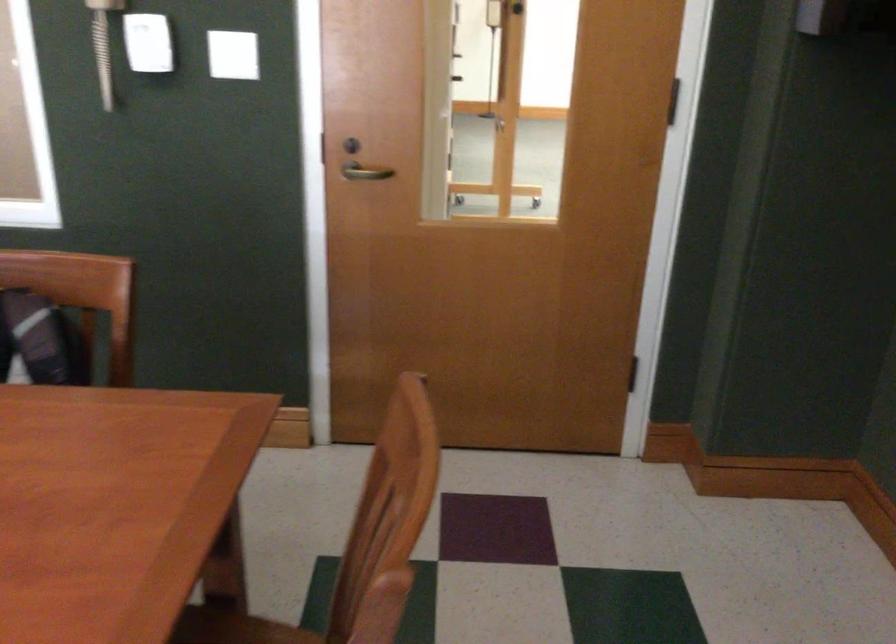
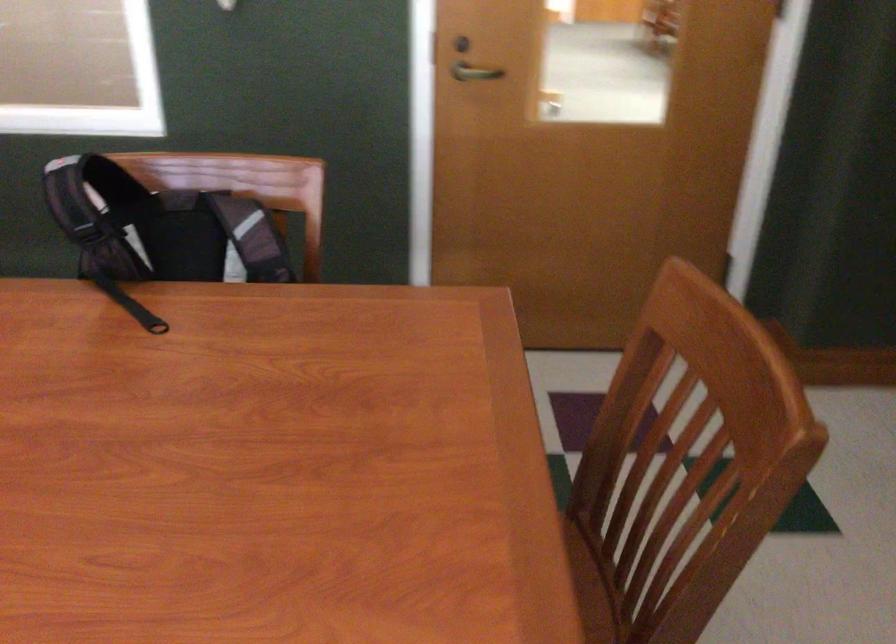
Question: The images are taken continuously from a first-person perspective. In which direction is your viewpoint rotating?

Choices:
 (A) Left
 (B) Right
 (C) Up
 (D) Down

Answer: (D)